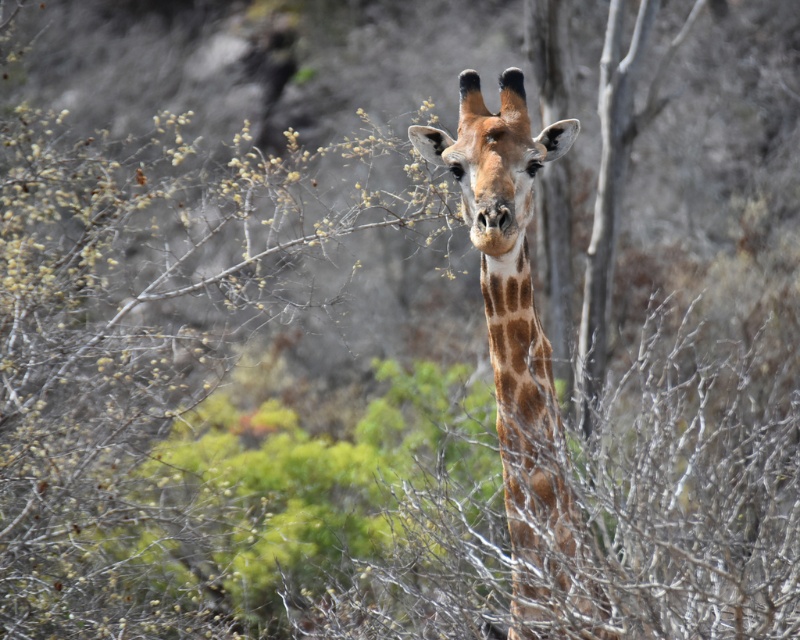
Question: Estimate the real-world distances between objects in this image. Which object is farther from the brown spotted giraffe at center?

Choices:
 (A) spotted fur giraffe head at center
 (B) brown spotted neck at center

Answer: (A)

Question: Can you confirm if brown spotted giraffe at center is positioned below brown spotted neck at center?

Choices:
 (A) yes
 (B) no

Answer: (A)

Question: Is brown spotted giraffe at center smaller than brown spotted neck at center?

Choices:
 (A) no
 (B) yes

Answer: (A)

Question: Among these objects, which one is nearest to the camera?

Choices:
 (A) brown spotted giraffe at center
 (B) spotted fur giraffe head at center

Answer: (A)

Question: Which point is closer to the camera?

Choices:
 (A) brown spotted neck at center
 (B) spotted fur giraffe head at center

Answer: (B)

Question: Does brown spotted giraffe at center come in front of brown spotted neck at center?

Choices:
 (A) no
 (B) yes

Answer: (B)